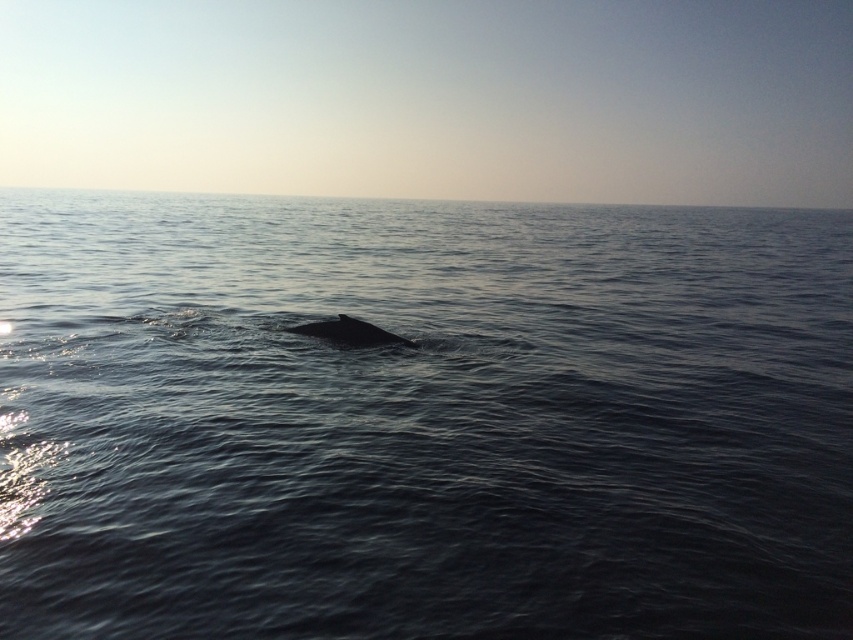
Who is lower down, dark blue water at center or gray matte whale at center?

gray matte whale at center is below.

Which of these two, dark blue water at center or gray matte whale at center, stands taller?

dark blue water at center is taller.

Who is more distant from viewer, (816, 410) or (398, 337)?

Positioned behind is point (398, 337).

Where is `dark blue water at center`? dark blue water at center is located at coordinates (422, 420).